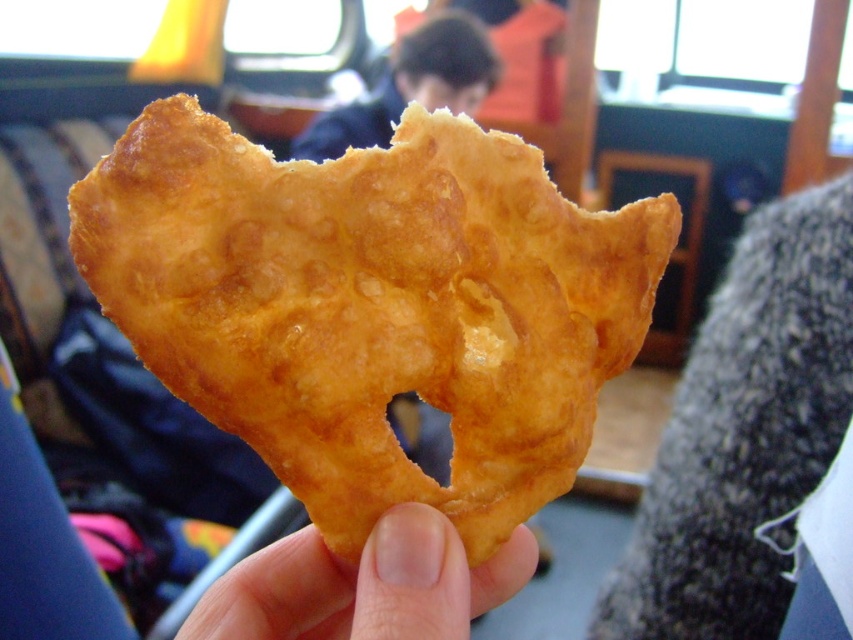
You are holding a fried snack in your hand and want to place it on a nearby seat. The seat is located at point (397, 536). Given that the seat is 19.61 inches away from you, can you safely reach it without dropping the snack?

The distance between you and the seat at point (397, 536) is 19.61 inches. Since this distance is within a typical comfortable reaching range, you can safely place the snack on the seat without dropping it.